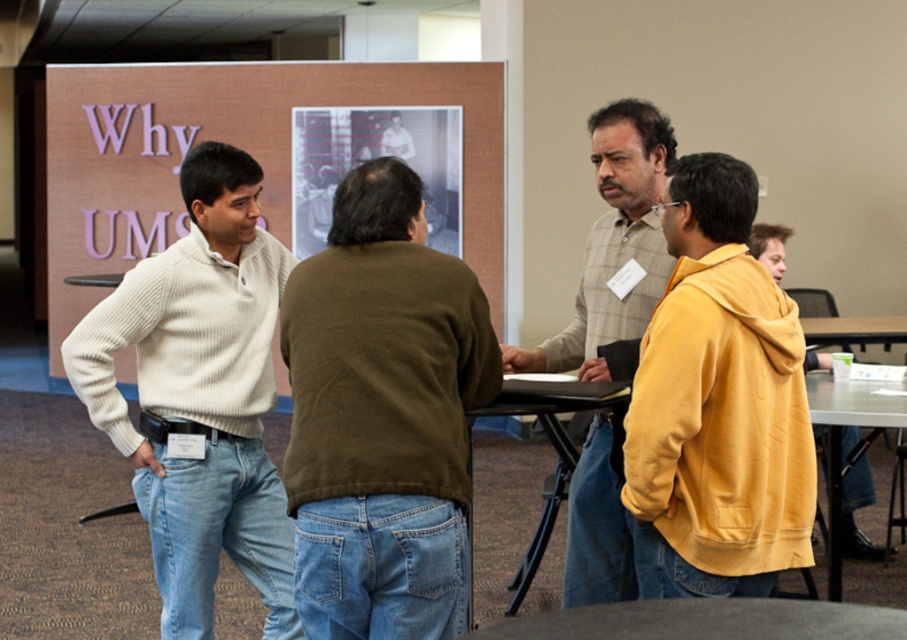
Is white ribbed sweater at left below smooth gray table at lower center?

Actually, white ribbed sweater at left is above smooth gray table at lower center.

Which of these two, white ribbed sweater at left or smooth gray table at lower center, stands taller?

Standing taller between the two is white ribbed sweater at left.

Which is in front, point (152, 324) or point (729, 621)?

Positioned in front is point (729, 621).

Identify the location of white ribbed sweater at left. pos(200,396).

This screenshot has height=640, width=907. Describe the element at coordinates (613, 246) in the screenshot. I see `light brown plaid shirt at center` at that location.

Who is more distant from viewer, (597, 432) or (786, 232)?

The point (786, 232) is more distant.

Who is more distant from viewer, (x=627, y=240) or (x=865, y=477)?

Point (x=865, y=477)

Identify the location of light brown plaid shirt at center. (613, 246).

Who is lower down, dark brown sweater at center or smooth gray table at lower center?

smooth gray table at lower center is lower down.

Between dark brown sweater at center and smooth gray table at lower center, which one appears on the right side from the viewer's perspective?

smooth gray table at lower center is more to the right.

Does point (378, 280) come farther from viewer compared to point (678, 634)?

Yes.

The width and height of the screenshot is (907, 640). Identify the location of dark brown sweater at center. (382, 417).